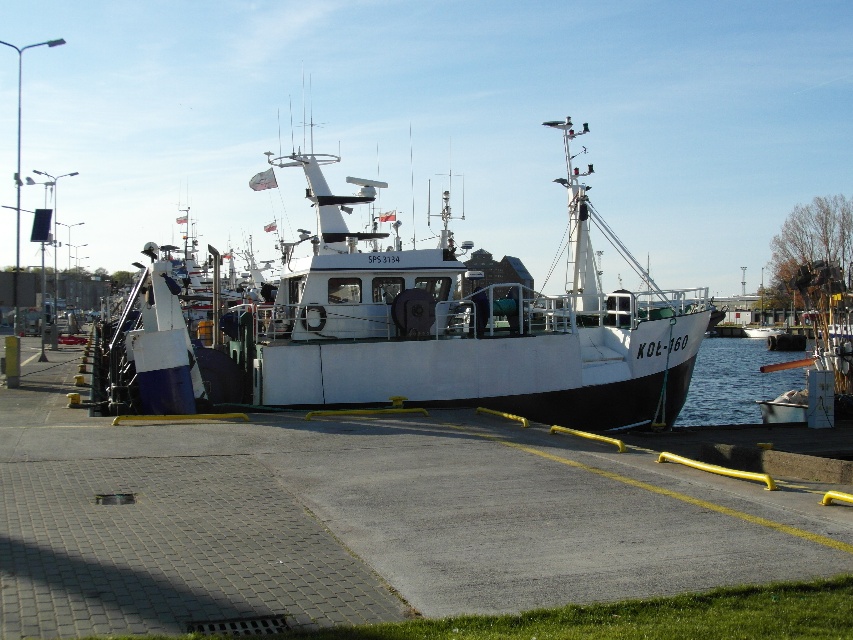
Question: Can you confirm if white matte boat at center is positioned to the left of clear blue water at lower right?

Choices:
 (A) no
 (B) yes

Answer: (B)

Question: Which of the following is the closest to the observer?

Choices:
 (A) white matte boat at center
 (B) clear blue water at lower right

Answer: (A)

Question: Does white matte boat at center have a smaller size compared to clear blue water at lower right?

Choices:
 (A) yes
 (B) no

Answer: (B)

Question: Which of the following is the closest to the observer?

Choices:
 (A) (450, 378)
 (B) (753, 353)

Answer: (A)

Question: Does white matte boat at center appear over clear blue water at lower right?

Choices:
 (A) yes
 (B) no

Answer: (A)